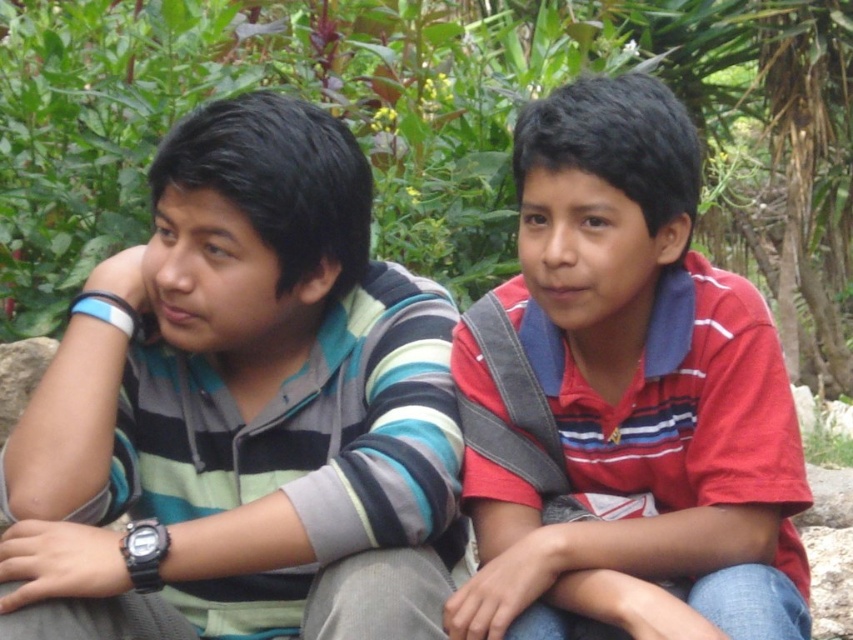
This screenshot has width=853, height=640. What do you see at coordinates (828, 579) in the screenshot? I see `gray stone at lower right` at bounding box center [828, 579].

Between gray stone at lower right and gray stone at lower center, which one has less height?

gray stone at lower center

Find the location of a particular element. This screenshot has width=853, height=640. gray stone at lower right is located at coordinates click(828, 579).

The image size is (853, 640). In order to click on gray stone at lower right in this screenshot , I will do `click(828, 579)`.

Who is more forward, (225,131) or (837,502)?

Point (225,131) is more forward.

Can you confirm if striped cotton shirt at left is positioned to the right of gray stone at lower center?

In fact, striped cotton shirt at left is to the left of gray stone at lower center.

Is point (403, 337) positioned in front of point (813, 484)?

Yes, it is.

At what (x,y) coordinates should I click in order to perform the action: click on striped cotton shirt at left. Please return your answer as a coordinate pair (x, y). The height and width of the screenshot is (640, 853). Looking at the image, I should click on (241, 412).

Locate an element on the screen. Image resolution: width=853 pixels, height=640 pixels. gray rock at lower left is located at coordinates (20, 376).

Can you confirm if gray rock at lower left is positioned to the left of gray stone at lower center?

Yes, gray rock at lower left is to the left of gray stone at lower center.

At what (x,y) coordinates should I click in order to perform the action: click on gray rock at lower left. Please return your answer as a coordinate pair (x, y). Looking at the image, I should click on (20, 376).